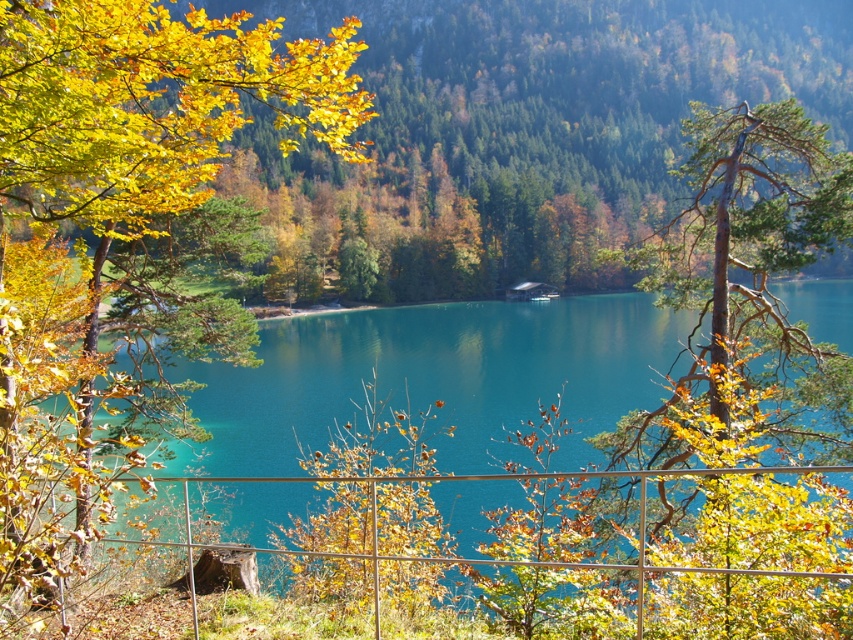
Between smooth bark tree at center and turquoise glossy water at center, which one has more height?

turquoise glossy water at center

Measure the distance between point (788, 536) and camera.

A distance of 20.98 feet exists between point (788, 536) and camera.

Find the location of a particular element. This screenshot has width=853, height=640. smooth bark tree at center is located at coordinates (746, 300).

Is yellow leafy tree at upper left closer to camera compared to metallic wire fence at lower center?

No, it is not.

Does point (265, 52) lie in front of point (527, 477)?

No, (265, 52) is behind (527, 477).

Does point (231, 108) come in front of point (161, 545)?

No, (231, 108) is behind (161, 545).

This screenshot has width=853, height=640. Identify the location of yellow leafy tree at upper left. (114, 225).

Is smooth bark tree at center above metallic wire fence at lower center?

Yes.

Which is more to the right, smooth bark tree at center or metallic wire fence at lower center?

→ Positioned to the right is smooth bark tree at center.

Is point (717, 524) behind point (144, 477)?

Yes, it is.

This screenshot has width=853, height=640. I want to click on smooth bark tree at center, so click(x=746, y=300).